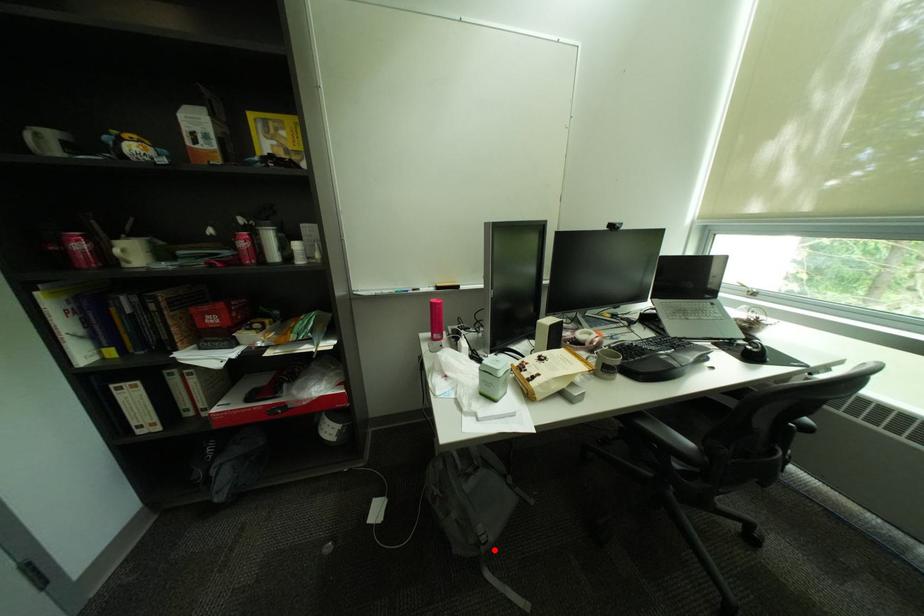
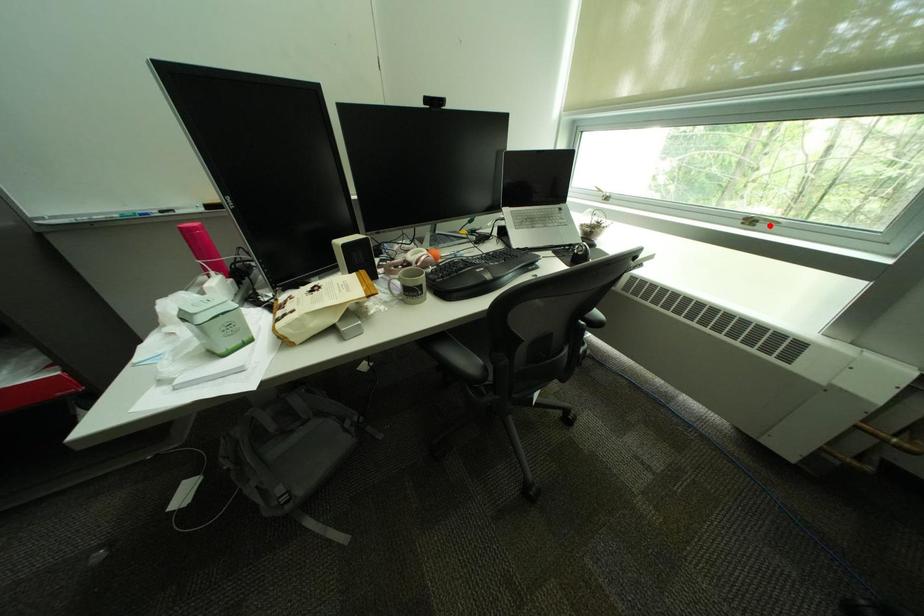
I am providing you with two images of the same scene from different viewpoints. A red point is marked on the first image and another point is marked on the second image. Are the points marked in image1 and image2 representing the same 3D position?

No